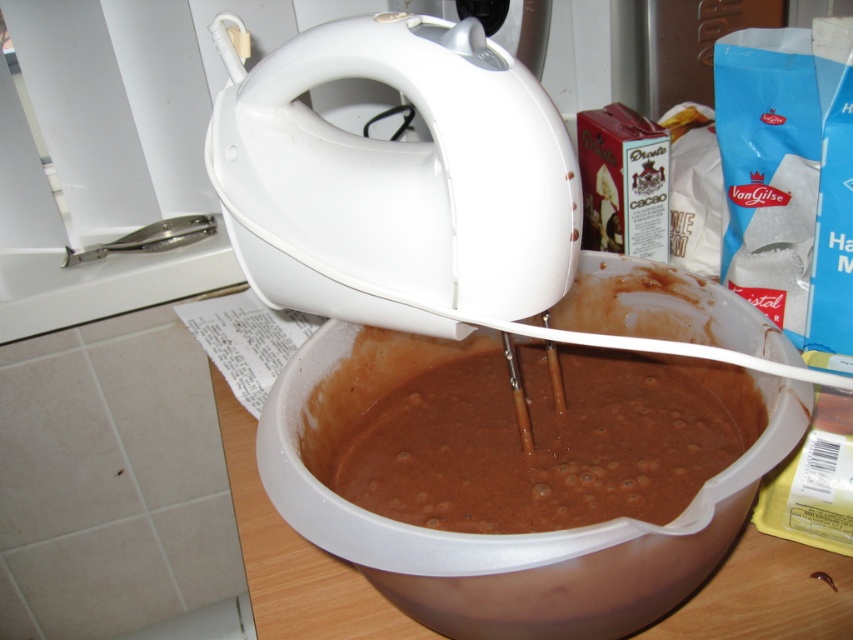
You are a baker preparing a cake and need to ensure the batter fits into the bowl. Based on the image, can you confirm if the brown matte plastic bowl at center is wide enough to contain the chocolate matte batter at center?

The brown matte plastic bowl at center might be wider than chocolate matte batter at center, so it is likely wide enough to contain the batter.

You are a chef preparing a cake and need to know which appliance is shorter between the white plastic mixer at upper center and the brown matte plastic bowl at center. Which one should you choose?

The white plastic mixer at upper center is not as tall as the brown matte plastic bowl at center, so the white plastic mixer at upper center is shorter and should be chosen.

You are a chef preparing a cake and need to determine the workspace. Given the white plastic mixer at upper center and the chocolate matte batter at center, which object occupies more horizontal space?

The chocolate matte batter at center occupies more horizontal space because the white plastic mixer at upper center has a lesser width compared to it.